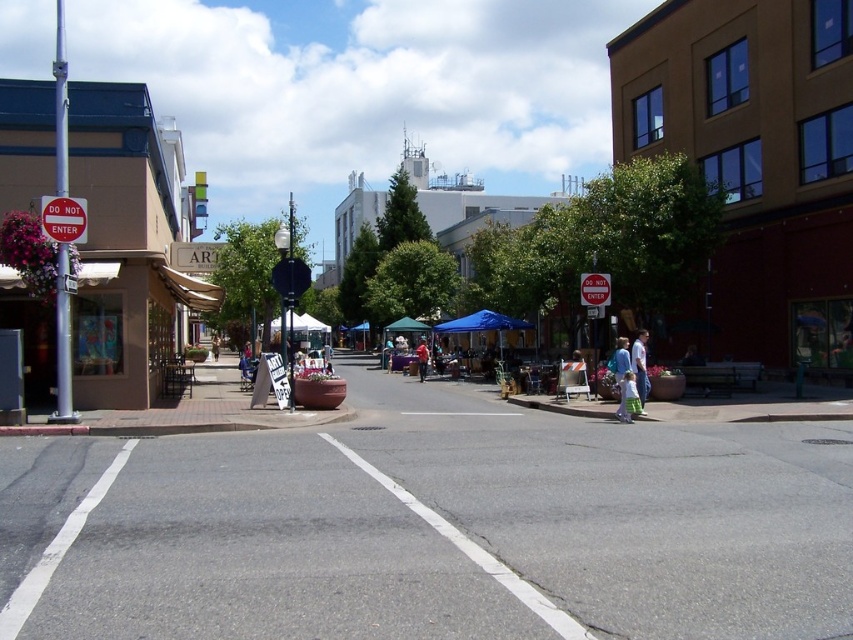
Question: Among these points, which one is farthest from the camera?

Choices:
 (A) (643, 387)
 (B) (178, 275)
 (C) (126, 13)
 (D) (62, 240)

Answer: (C)

Question: Among these points, which one is farthest from the camera?

Choices:
 (A) (51, 212)
 (B) (154, 17)
 (C) (105, 396)
 (D) (65, 509)

Answer: (B)

Question: Is the position of red plastic sign at center less distant than that of light blue denim jeans at center?

Choices:
 (A) no
 (B) yes

Answer: (B)

Question: Which of the following is the closest to the observer?

Choices:
 (A) (579, 288)
 (B) (55, 224)
 (C) (614, 356)
 (D) (178, 12)

Answer: (B)

Question: Is red plastic sign at center to the left of light blue jeans at center from the viewer's perspective?

Choices:
 (A) yes
 (B) no

Answer: (A)

Question: Is smooth asphalt road at center positioned at the back of red plastic stop sign at center?

Choices:
 (A) no
 (B) yes

Answer: (A)